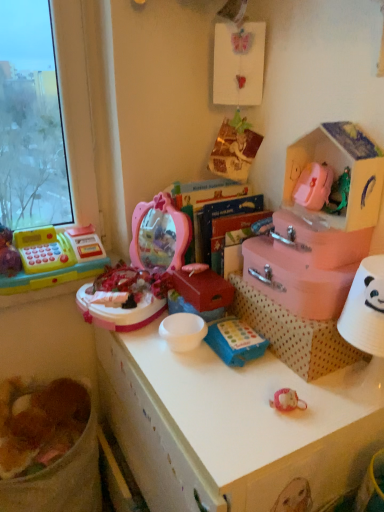
Locate an element on the screen. This screenshot has height=512, width=384. vacant area situated below pink cardboard storage box at upper right (from a real-world perspective) is located at coordinates (312, 224).